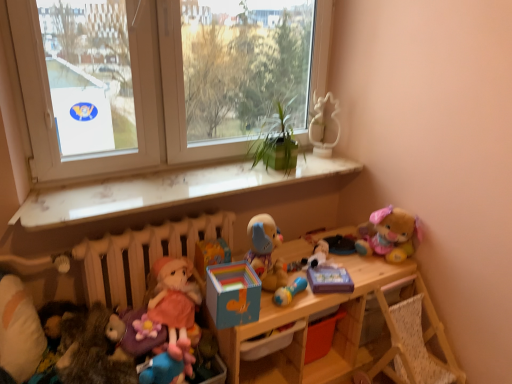
Find the location of a particular element. This screenshot has height=384, width=512. white glossy statue at upper right is located at coordinates (318, 118).

The width and height of the screenshot is (512, 384). What do you see at coordinates (305, 328) in the screenshot? I see `wooden toy box at center` at bounding box center [305, 328].

This screenshot has height=384, width=512. In order to click on wooden toy box at center in this screenshot , I will do `click(305, 328)`.

The height and width of the screenshot is (384, 512). I want to click on white marble window sill at upper center, so click(x=166, y=190).

Who is taller, white glossy statue at upper right or white matte radiator at lower left?

white matte radiator at lower left is taller.

Where is `miniature above the white matte radiator at lower left (from the image's perspective)`? This screenshot has width=512, height=384. miniature above the white matte radiator at lower left (from the image's perspective) is located at coordinates (318, 118).

Measure the distance from white glossy statue at upper right to white matte radiator at lower left.

The distance of white glossy statue at upper right from white matte radiator at lower left is 98.57 centimeters.

Is point (321, 104) closer to viewer compared to point (194, 228)?

No, (321, 104) is behind (194, 228).

Does woven fabric feeding chair at lower right have a lesser width compared to velvet purple doll at lower left, positioned as the 2th toy in left-to-right order?

Incorrect, the width of woven fabric feeding chair at lower right is not less than that of velvet purple doll at lower left, positioned as the 2th toy in left-to-right order.

Is woven fabric feeding chair at lower right positioned far away from velvet purple doll at lower left, positioned as the 2th toy in left-to-right order?

That's right, there is a large distance between woven fabric feeding chair at lower right and velvet purple doll at lower left, positioned as the 2th toy in left-to-right order.

Which of these two, woven fabric feeding chair at lower right or velvet purple doll at lower left, which is the sixth toy in right-to-left order, stands taller?

With more height is woven fabric feeding chair at lower right.

From a real-world perspective, which object rests below the other?

In real-world perspective, woven fabric feeding chair at lower right is lower.

Considering the sizes of objects white glossy statue at upper right and woven fabric feeding chair at lower right in the image provided, who is bigger, white glossy statue at upper right or woven fabric feeding chair at lower right?

Bigger between the two is woven fabric feeding chair at lower right.

Where is `miniature that appears on the left of woven fabric feeding chair at lower right`? This screenshot has height=384, width=512. miniature that appears on the left of woven fabric feeding chair at lower right is located at coordinates (318, 118).

Does white glossy statue at upper right have a lesser width compared to woven fabric feeding chair at lower right?

Yes.

Can we say white glossy statue at upper right lies outside woven fabric feeding chair at lower right?

Absolutely, white glossy statue at upper right is external to woven fabric feeding chair at lower right.

Can you tell me how much white matte radiator at lower left and multicolored cardboard box at center, the fourth toy viewed from the left, differ in facing direction?

white matte radiator at lower left and multicolored cardboard box at center, the fourth toy viewed from the left, are facing 11.7 degrees away from each other.

In the scene shown: Considering the relative sizes of white matte radiator at lower left and multicolored cardboard box at center, the fourth toy viewed from the left, in the image provided, is white matte radiator at lower left thinner than multicolored cardboard box at center, the fourth toy viewed from the left,?

Yes, white matte radiator at lower left is thinner than multicolored cardboard box at center, the fourth toy viewed from the left.

From the image's perspective, between white matte radiator at lower left and multicolored cardboard box at center, the fourth toy viewed from the left, which one is located above?

multicolored cardboard box at center, the fourth toy viewed from the left, is shown above in the image.

Find the location of a particular element. This screenshot has width=512, height=384. radiator in front of the multicolored cardboard box at center, the fourth toy viewed from the left is located at coordinates coord(142,255).

Is soft plush toy at center, positioned as the fifth toy in left-to-right order, positioned far away from white paper at upper left, positioned as the 2th window screen in right-to-left order?

Yes.

Could you tell me if soft plush toy at center, the third toy in the right-to-left sequence, is facing white paper at upper left, which is the 1th window screen in left-to-right order?

No, soft plush toy at center, the third toy in the right-to-left sequence, is not oriented towards white paper at upper left, which is the 1th window screen in left-to-right order.

From the image's perspective, is soft plush toy at center, the third toy in the right-to-left sequence, located above or below white paper at upper left, positioned as the 2th window screen in right-to-left order?

From the image's perspective, soft plush toy at center, the third toy in the right-to-left sequence, appears below white paper at upper left, positioned as the 2th window screen in right-to-left order.

Is point (132, 250) closer to camera compared to point (136, 341)?

No, (132, 250) is further to viewer.

Is white matte radiator at lower left in contact with velvet purple doll at lower left, which is the sixth toy in right-to-left order?

No, white matte radiator at lower left is not making contact with velvet purple doll at lower left, which is the sixth toy in right-to-left order.

In the scene shown: Considering the sizes of white matte radiator at lower left and velvet purple doll at lower left, which is the sixth toy in right-to-left order, in the image, is white matte radiator at lower left bigger or smaller than velvet purple doll at lower left, which is the sixth toy in right-to-left order,?

Considering their sizes, white matte radiator at lower left takes up more space than velvet purple doll at lower left, which is the sixth toy in right-to-left order.

From a real-world perspective, who is located lower, white matte radiator at lower left or velvet purple doll at lower left, which is the sixth toy in right-to-left order?

velvet purple doll at lower left, which is the sixth toy in right-to-left order.

Is white soft pillow at lower left further to the viewer compared to blue rubber rattle at center, the 2th toy when ordered from right to left?

No, white soft pillow at lower left is closer to the camera.

From the picture: Is white soft pillow at lower left turned away from blue rubber rattle at center, placed as the sixth toy when sorted from left to right?

That's not correct — white soft pillow at lower left is not looking away from blue rubber rattle at center, placed as the sixth toy when sorted from left to right.

Find the location of a particular element. The width and height of the screenshot is (512, 384). toy that is the 6th one when counting rightward from the white soft pillow at lower left is located at coordinates click(289, 291).

Measure the distance from white soft pillow at lower left to blue rubber rattle at center, placed as the sixth toy when sorted from left to right.

white soft pillow at lower left is 36.36 inches from blue rubber rattle at center, placed as the sixth toy when sorted from left to right.

I want to click on miniature that is on the right side of white matte radiator at lower left, so click(318, 118).

Where is `the 3rd toy located above the woven fabric feeding chair at lower right (from a real-world perspective)`? The image size is (512, 384). the 3rd toy located above the woven fabric feeding chair at lower right (from a real-world perspective) is located at coordinates coord(131,335).

Considering their positions, is multicolored cardboard box at center, the fourth toy viewed from the left, positioned closer to white soft pillow at lower left than velvet purple doll at lower left, positioned as the 2th toy in left-to-right order?

velvet purple doll at lower left, positioned as the 2th toy in left-to-right order.

Looking at the image, which one is located closer to multicolored cardboard box at center, the fourth toy viewed from the left, white marble window sill at upper center or wooden toy box at center?

white marble window sill at upper center lies closer to multicolored cardboard box at center, the fourth toy viewed from the left, than the other object.

When comparing their distances from blue rubber rattle at center, placed as the sixth toy when sorted from left to right, does multicolored cardboard box at center, acting as the 4th toy starting from the right, or soft plush toy at center, the third toy in the right-to-left sequence, seem further?

multicolored cardboard box at center, acting as the 4th toy starting from the right, is further to blue rubber rattle at center, placed as the sixth toy when sorted from left to right.

Based on their spatial positions, is blue plush toy at lower left, the fifth toy when ordered from right to left, or fluffy plush bear at upper right, placed as the 7th toy when sorted from left to right, further from white marble window sill at upper center?

Among the two, blue plush toy at lower left, the fifth toy when ordered from right to left, is located further to white marble window sill at upper center.

Considering their positions, is blue rubber rattle at center, the 2th toy when ordered from right to left, positioned further to transparent glass window at center, which is the 1th window screen from right to left, than wooden toy box at center?

Among the two, blue rubber rattle at center, the 2th toy when ordered from right to left, is located further to transparent glass window at center, which is the 1th window screen from right to left.

Consider the image. From the image, which object appears to be nearer to white marble window sill at upper center, blue rubber rattle at center, placed as the sixth toy when sorted from left to right, or white glossy statue at upper right?

Among the two, white glossy statue at upper right is located nearer to white marble window sill at upper center.

Based on their spatial positions, is blue plush toy at lower left, the 3th toy in the left-to-right sequence, or white marble window sill at upper center closer to transparent glass window at center, which is the 1th window screen from right to left?

white marble window sill at upper center lies closer to transparent glass window at center, which is the 1th window screen from right to left, than the other object.

Based on their spatial positions, is blue plush toy at lower left, the 3th toy in the left-to-right sequence, or fluffy plush bear at upper right, which ranks as the first toy in right-to-left order, further from transparent glass window at center, which ranks as the second window screen in left-to-right order?

blue plush toy at lower left, the 3th toy in the left-to-right sequence, is further to transparent glass window at center, which ranks as the second window screen in left-to-right order.

You are a GUI agent. You are given a task and a screenshot of the screen. Output one action in this format:
    pyautogui.click(x=<x>, y=<y>)
    Task: Click on the miniature located between white matte radiator at lower left and woven fabric feeding chair at lower right in the left-right direction
    This screenshot has width=512, height=384.
    Given the screenshot: What is the action you would take?
    pyautogui.click(x=318, y=118)

You are a GUI agent. You are given a task and a screenshot of the screen. Output one action in this format:
    pyautogui.click(x=<x>, y=<y>)
    Task: Click on the window sill between white glossy statue at upper right and velvet purple doll at lower left, which is the sixth toy in right-to-left order, vertically
    The height and width of the screenshot is (384, 512).
    Given the screenshot: What is the action you would take?
    pyautogui.click(x=166, y=190)

Find the location of a particular element. This screenshot has width=512, height=384. shelf located between multicolored cardboard box at center, the fourth toy viewed from the left, and woven fabric feeding chair at lower right in the left-right direction is located at coordinates (305, 328).

Find the location of a particular element. The width and height of the screenshot is (512, 384). window sill between white glossy statue at upper right and fluffy plush doll at lower left, placed as the 7th toy when sorted from right to left, vertically is located at coordinates (166, 190).